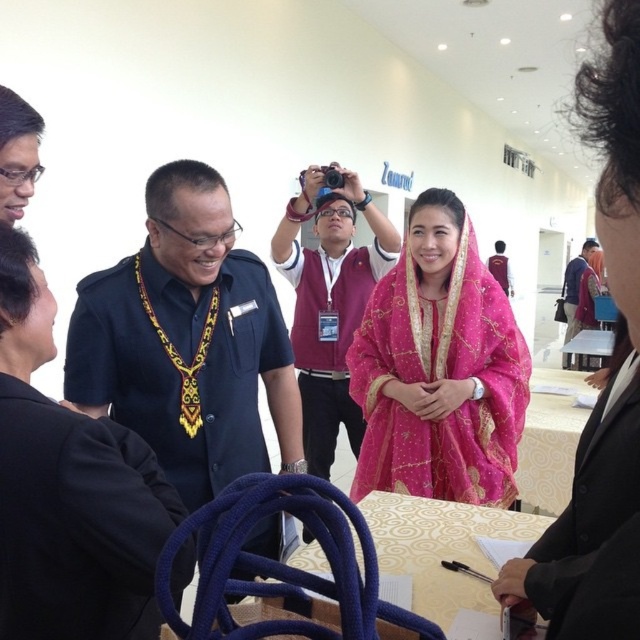
You are standing at the center of the hall and see two points marked on the wall. The first point is at coordinates point [196,246] and the second is at point [605,474]. Which point is closer to you?

Point [605,474] is closer to you because it is in front of point [196,246].